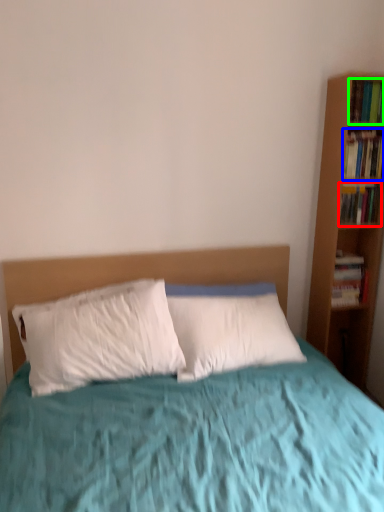
Question: Based on their relative distances, which object is nearer to book (highlighted by a red box)? Choose from book (highlighted by a blue box) and book (highlighted by a green box).

Choices:
 (A) book
 (B) book

Answer: (A)